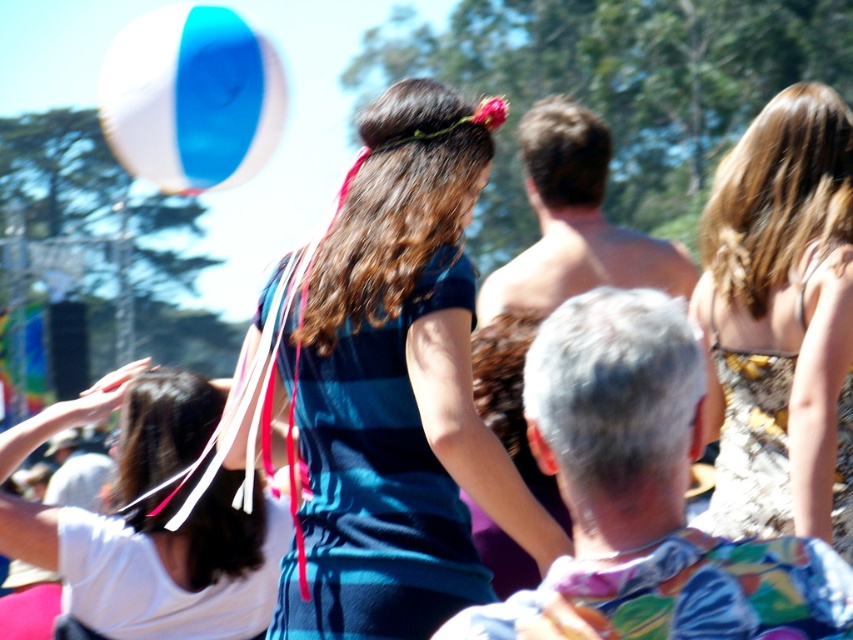
Does brown textured dress at center have a greater height compared to white fabric headband at upper left?

Yes, brown textured dress at center is taller than white fabric headband at upper left.

Looking at this image, is brown textured dress at center shorter than white fabric headband at upper left?

In fact, brown textured dress at center may be taller than white fabric headband at upper left.

The width and height of the screenshot is (853, 640). I want to click on brown textured dress at center, so click(x=782, y=321).

Between point (332, 243) and point (248, 156), which one is positioned in front?

Point (332, 243) is in front.

The height and width of the screenshot is (640, 853). Find the location of `blue striped shirt at center`. blue striped shirt at center is located at coordinates (399, 388).

Does blue striped shirt at center have a lesser width compared to white fabric headband at upper left?

In fact, blue striped shirt at center might be wider than white fabric headband at upper left.

What do you see at coordinates (399, 388) in the screenshot? I see `blue striped shirt at center` at bounding box center [399, 388].

I want to click on blue striped shirt at center, so click(x=399, y=388).